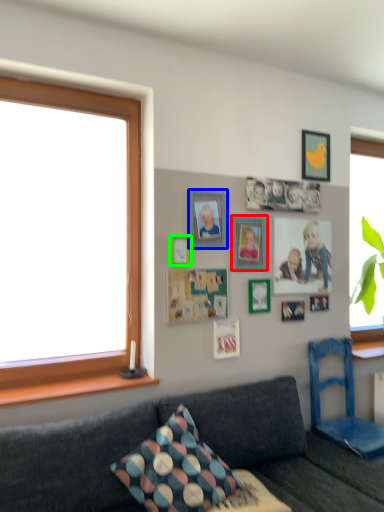
Question: Which is farther away from picture frame (highlighted by a red box)? picture frame (highlighted by a blue box) or picture frame (highlighted by a green box)?

Choices:
 (A) picture frame
 (B) picture frame

Answer: (B)